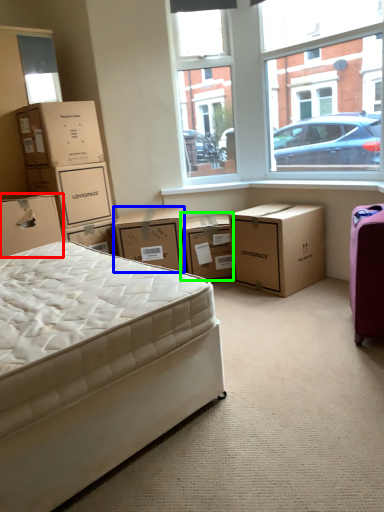
Question: Which object is the closest to the box (highlighted by a red box)? Choose among these: box (highlighted by a blue box) or box (highlighted by a green box).

Choices:
 (A) box
 (B) box

Answer: (A)